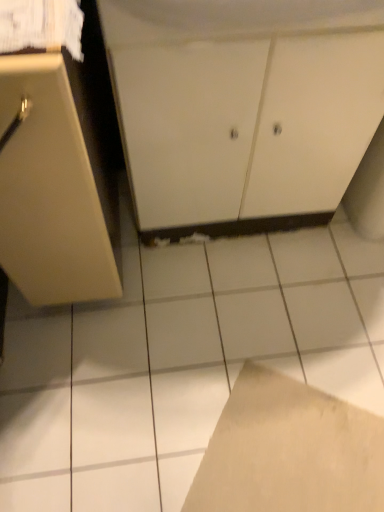
What are the coordinates of `free space in front of matte beige cabinet at left, marked as the first cabinetry in a left-to-right arrangement` in the screenshot? It's located at (x=90, y=376).